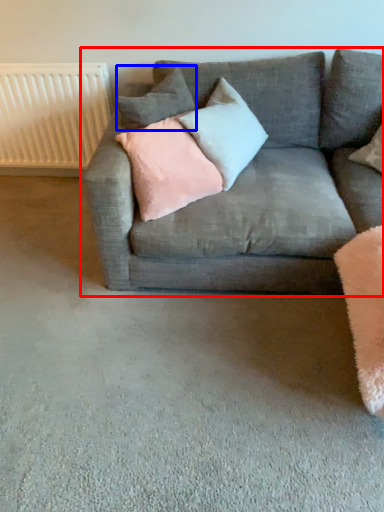
Question: Which point is closer to the camera, studio couch (highlighted by a red box) or pillow (highlighted by a blue box)?

Choices:
 (A) studio couch
 (B) pillow

Answer: (A)